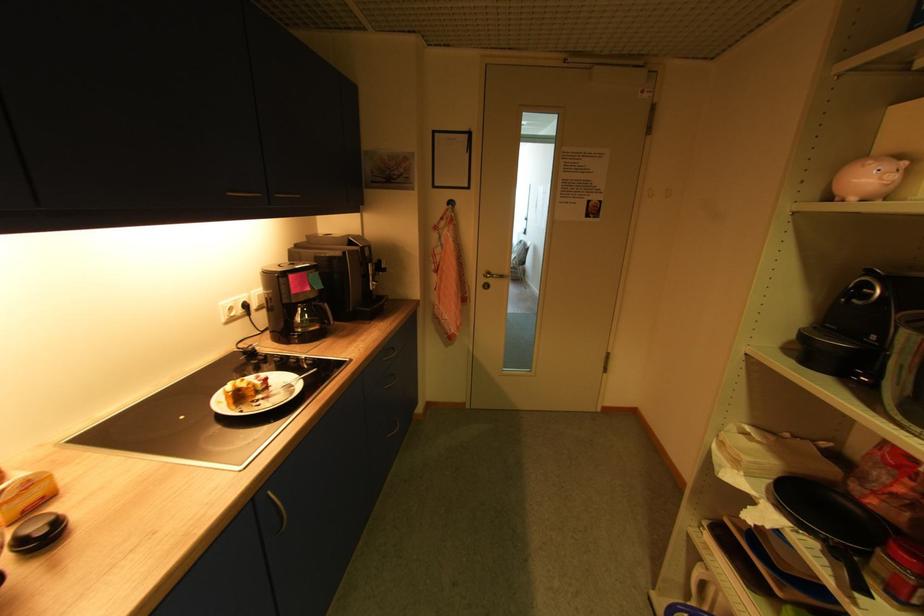
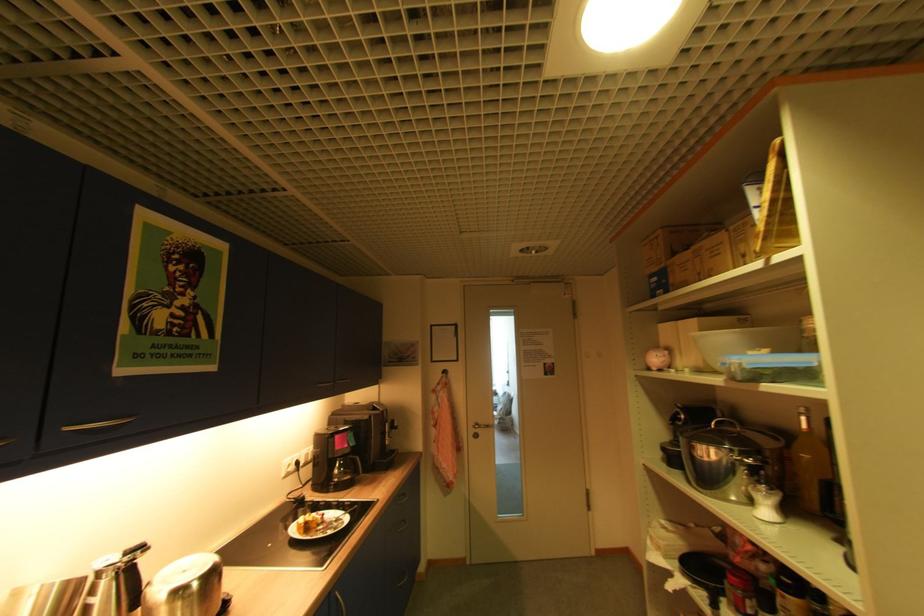
Question: The first image is from the beginning of the video and the second image is from the end. How did the camera likely rotate when shooting the video?

Choices:
 (A) Left
 (B) Right
 (C) Up
 (D) Down

Answer: (C)